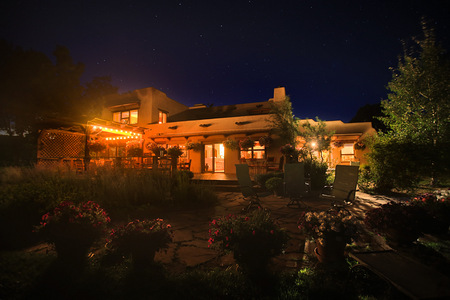
Locate an element on the screen. chair is located at coordinates (247, 184).